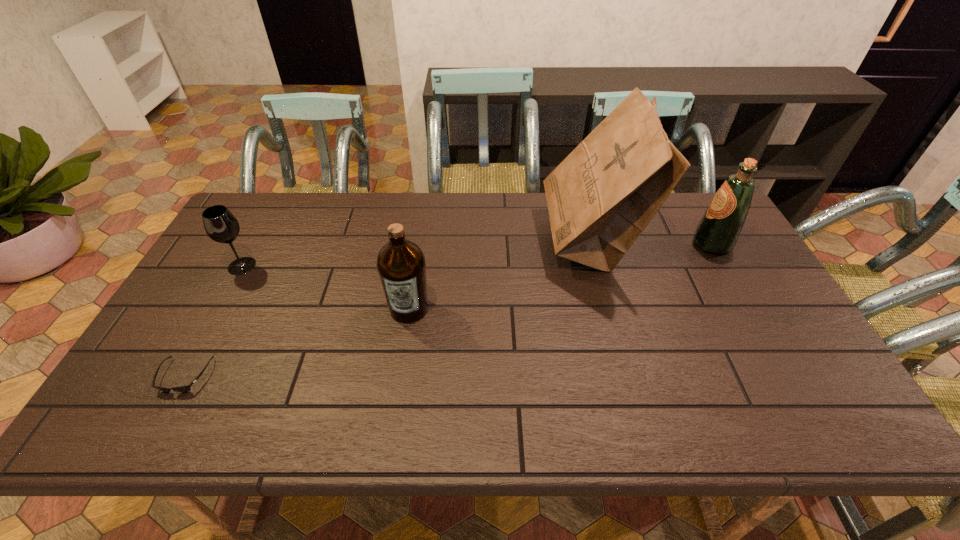
You are a GUI agent. You are given a task and a screenshot of the screen. Output one action in this format:
    pyautogui.click(x=<x>, y=<y>)
    Task: Click on the object located in the far right corner section of the desktop
    
    Given the screenshot: What is the action you would take?
    pyautogui.click(x=718, y=230)

In order to click on vacant region at the far edge in this screenshot , I will do `click(491, 205)`.

Identify the location of free space at the near edge. (524, 432).

In the image, there is a desktop. At what (x,y) coordinates should I click in order to perform the action: click on free space at the left edge. Please return your answer as a coordinate pair (x, y). This screenshot has height=540, width=960. Looking at the image, I should click on (150, 397).

You are a GUI agent. You are given a task and a screenshot of the screen. Output one action in this format:
    pyautogui.click(x=<x>, y=<y>)
    Task: Click on the free region at the right edge of the desktop
    Image resolution: width=960 pixels, height=540 pixels.
    Given the screenshot: What is the action you would take?
    pyautogui.click(x=812, y=394)

In the image, there is a desktop. At what (x,y) coordinates should I click in order to perform the action: click on free space at the far left corner. Please return your answer as a coordinate pair (x, y). Looking at the image, I should click on (276, 198).

Locate an element on the screen. vacant space at the near left corner of the desktop is located at coordinates (156, 402).

In the image, there is a desktop. Where is `vacant space at the near right corner`? Image resolution: width=960 pixels, height=540 pixels. vacant space at the near right corner is located at coordinates (778, 407).

Find the location of a particular element. The width and height of the screenshot is (960, 540). free space between the rightmost object and the second nearest object is located at coordinates (561, 276).

Locate an element on the screen. The width and height of the screenshot is (960, 540). unoccupied position between the farther olive oil and the tallest object is located at coordinates (651, 242).